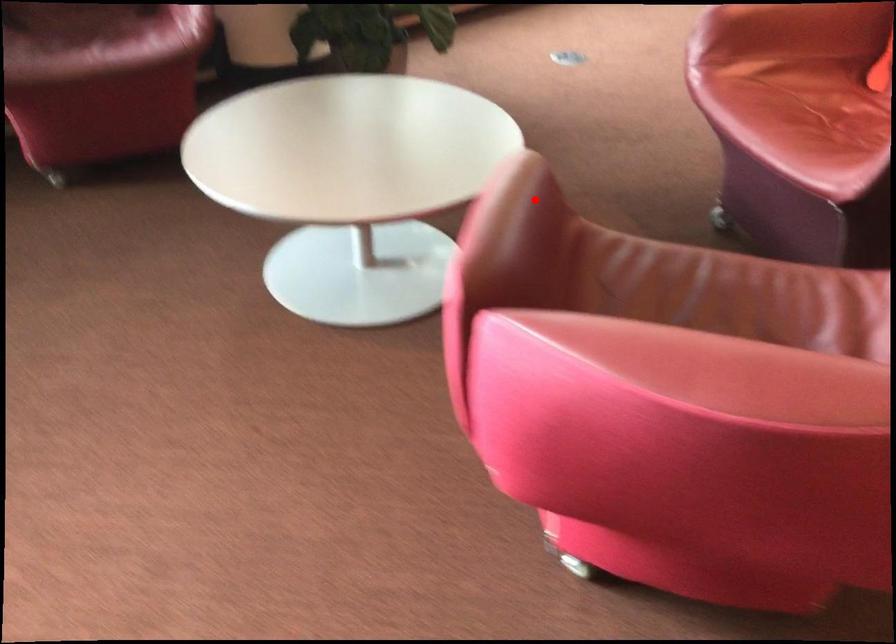
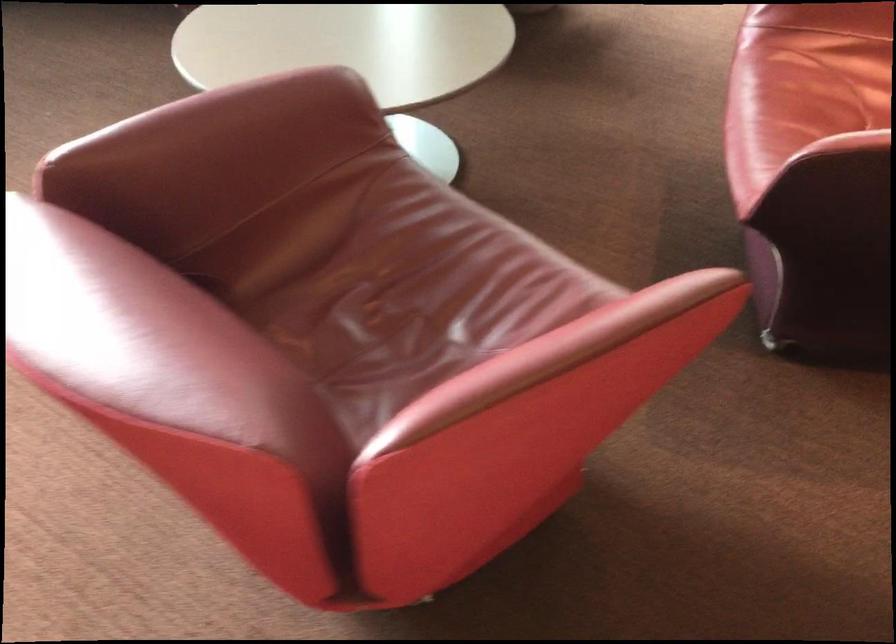
Question: I am providing you with two images of the same scene from different viewpoints. A red point is marked on the first image. Is the red point's position out of view in image 2?

Choices:
 (A) Yes
 (B) No

Answer: (B)